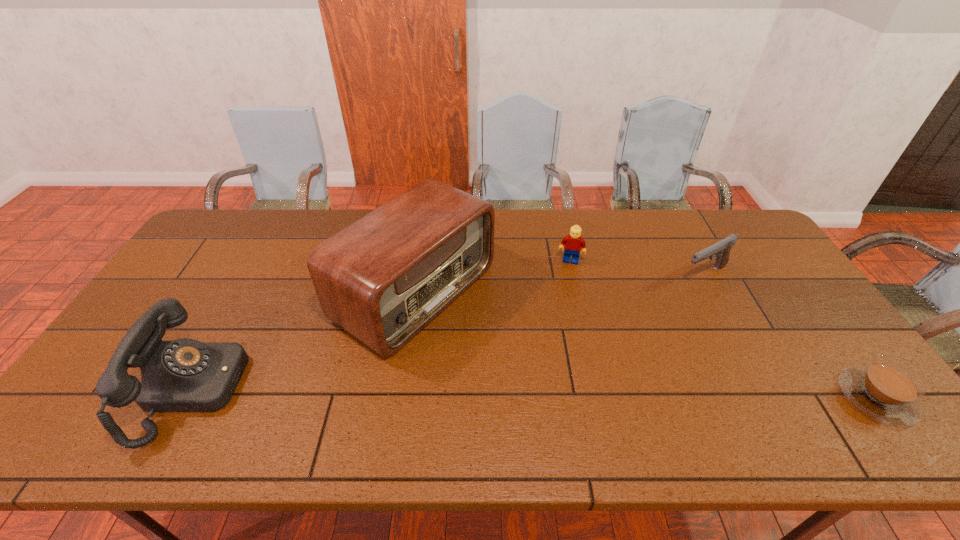
Locate an element on the screen. The width and height of the screenshot is (960, 540). the second tallest object is located at coordinates (185, 375).

In order to click on telephone in this screenshot , I will do `click(185, 375)`.

Locate an element on the screen. the shortest object is located at coordinates (887, 390).

At what (x,y) coordinates should I click in order to perform the action: click on the rightmost object. Please return your answer as a coordinate pair (x, y). The height and width of the screenshot is (540, 960). Looking at the image, I should click on (887, 390).

In order to click on the second object from left to right in this screenshot , I will do `click(384, 278)`.

Image resolution: width=960 pixels, height=540 pixels. Identify the location of radio receiver. (384, 278).

The image size is (960, 540). I want to click on Lego, so click(x=573, y=242).

The width and height of the screenshot is (960, 540). Find the location of `pistol`. pistol is located at coordinates (722, 248).

Locate an element on the screen. This screenshot has width=960, height=540. free space located on the dial of the leftmost object is located at coordinates (319, 389).

Locate an element on the screen. Image resolution: width=960 pixels, height=540 pixels. vacant point located on the back of the rightmost object is located at coordinates (806, 305).